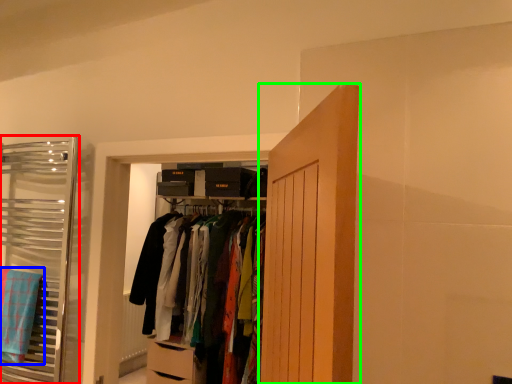
Question: Which is nearer to the closet (highlighted by a red box)? bath towel (highlighted by a blue box) or door (highlighted by a green box).

Choices:
 (A) bath towel
 (B) door

Answer: (A)